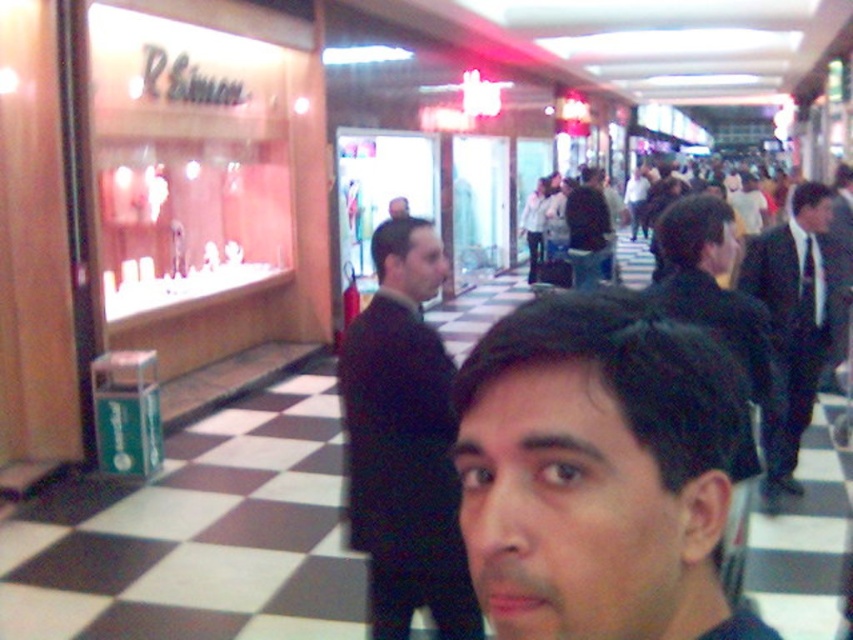
Question: Does black suit at center appear over dark brown suit at center?

Choices:
 (A) yes
 (B) no

Answer: (B)

Question: Considering the real-world distances, which object is farthest from the dark brown suit at center?

Choices:
 (A) black suit at center
 (B) dark hair at center

Answer: (B)

Question: Estimate the real-world distances between objects in this image. Which object is farther from the black suit at right?

Choices:
 (A) black suit at center
 (B) dark brown suit at center
 (C) dark hair at center

Answer: (B)

Question: Is dark hair at center above black suit at right?

Choices:
 (A) yes
 (B) no

Answer: (A)

Question: Does black suit at center appear on the left side of black suit at right?

Choices:
 (A) no
 (B) yes

Answer: (B)

Question: Which point appears closest to the camera in this image?

Choices:
 (A) (769, 262)
 (B) (375, 396)
 (C) (699, 547)

Answer: (C)